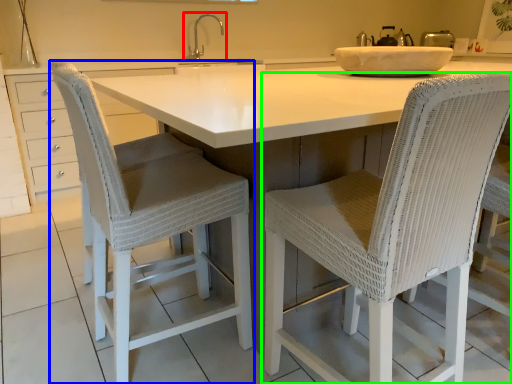
Question: Considering the real-world distances, which object is farthest from tap (highlighted by a red box)? chair (highlighted by a blue box) or chair (highlighted by a green box)?

Choices:
 (A) chair
 (B) chair

Answer: (B)